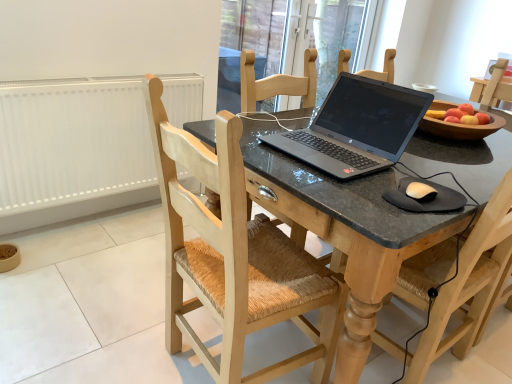
Question: From a real-world perspective, is white matte mouse at lower right positioned above or below matte black laptop at center?

Choices:
 (A) below
 (B) above

Answer: (B)

Question: Relative to matte black laptop at center, is white matte mouse at lower right in front or behind?

Choices:
 (A) behind
 (B) front

Answer: (A)

Question: Based on their relative distances, which object is farther from the matte black laptop at center?

Choices:
 (A) light wood chair at center, which appears as the second chair when viewed from the right
 (B) wooden woven seat at center, the 1th chair in the right-to-left sequence
 (C) white matte radiator at left
 (D) slate gray laptop at center
 (E) white matte mouse at lower right

Answer: (C)

Question: Estimate the real-world distances between objects in this image. Which object is farther from the white matte mouse at lower right?

Choices:
 (A) slate gray laptop at center
 (B) matte black laptop at center
 (C) wooden woven seat at center, the 1th chair in the right-to-left sequence
 (D) transparent glass door at upper center
 (E) black rubber mousepad at lower right

Answer: (D)